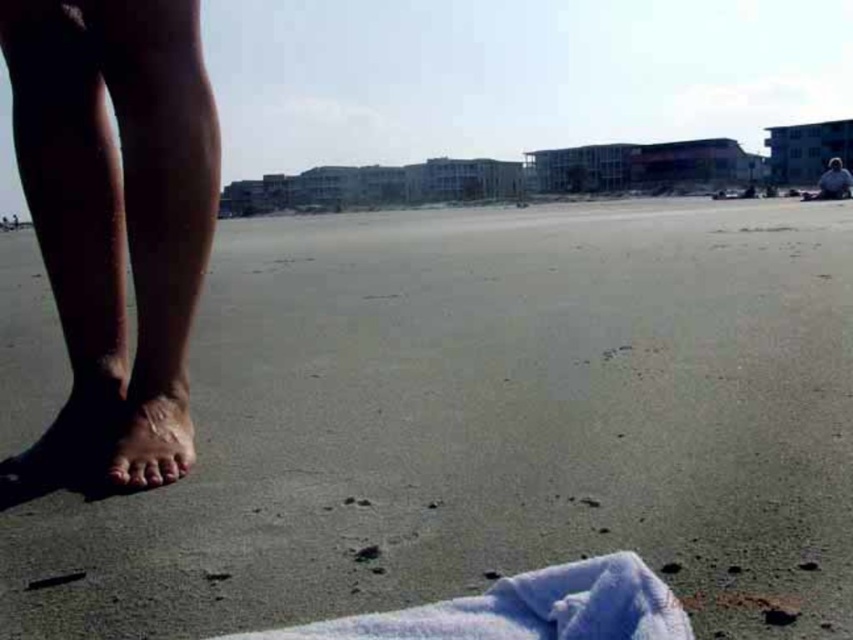
Between dry skin at lower left and dry skin foot at lower left, which one has more height?

With more height is dry skin at lower left.

Between point (143, 45) and point (148, 440), which one is positioned behind?

Point (148, 440)

The image size is (853, 640). In order to click on dry skin at lower left in this screenshot , I will do `click(115, 218)`.

Which of these two, dry skin at lower left or dark blue fabric at upper right, stands taller?

Standing taller between the two is dry skin at lower left.

Measure the distance between dry skin at lower left and camera.

The distance of dry skin at lower left from camera is 1.25 meters.

Which is behind, point (128, 410) or point (820, 186)?

The point (820, 186) is behind.

Locate an element on the screen. The height and width of the screenshot is (640, 853). dry skin at lower left is located at coordinates (115, 218).

Can you confirm if sandy beach at lower left is wider than dark blue fabric at upper right?

No, sandy beach at lower left is not wider than dark blue fabric at upper right.

Who is higher up, sandy beach at lower left or dark blue fabric at upper right?

dark blue fabric at upper right

The image size is (853, 640). I want to click on sandy beach at lower left, so click(x=486, y=422).

At what (x,y) coordinates should I click in order to perform the action: click on sandy beach at lower left. Please return your answer as a coordinate pair (x, y). Looking at the image, I should click on (486, 422).